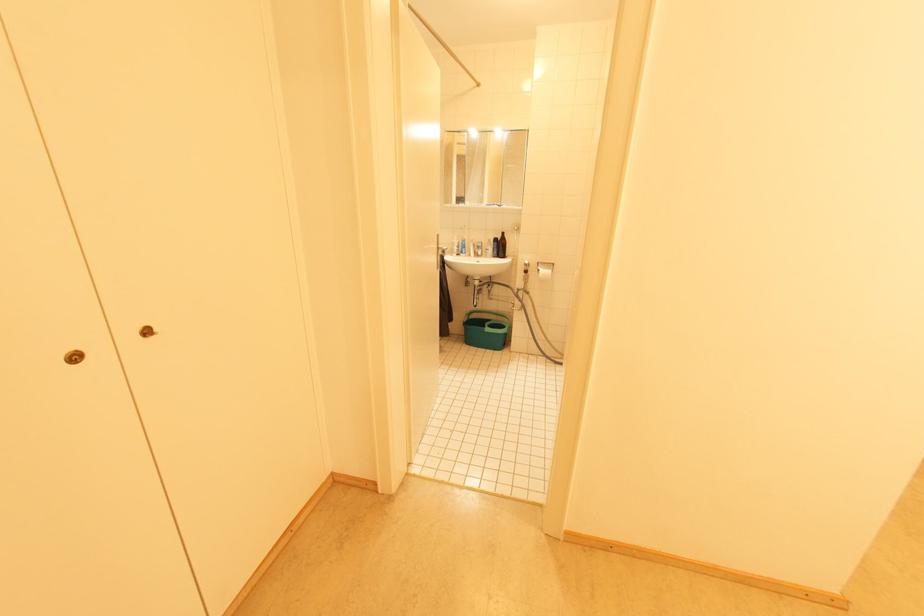
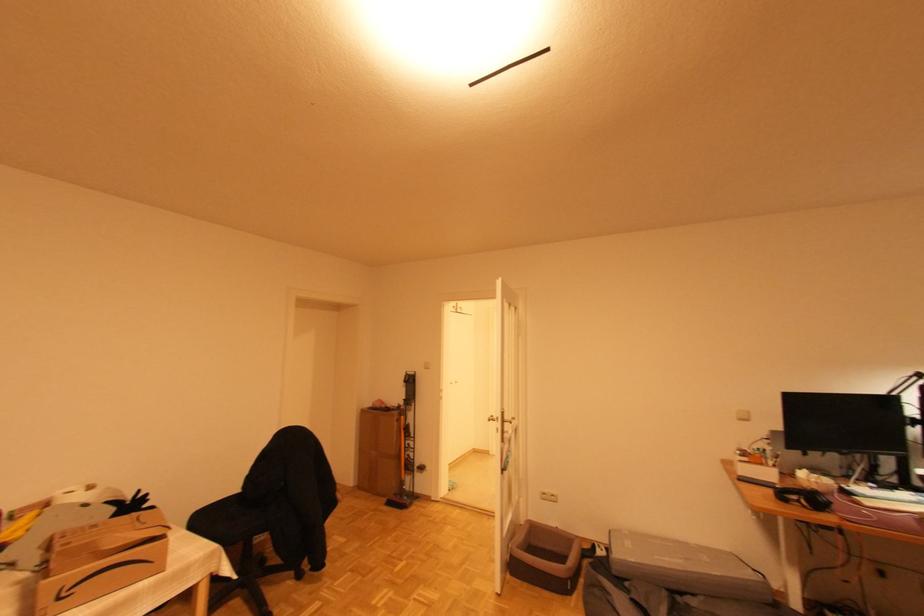
Question: Which direction would the cameraman need to move to produce the second image? Reply with the corresponding letter.

Choices:
 (A) Left
 (B) Right
 (C) Forward
 (D) Backward

Answer: (D)